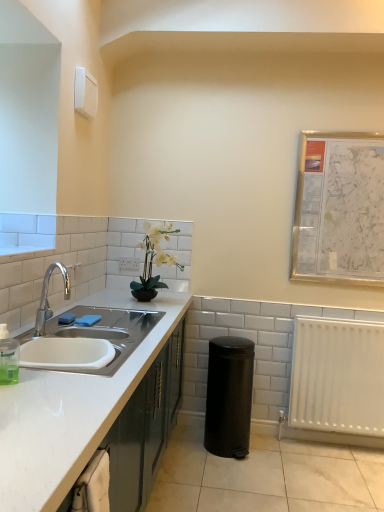
The width and height of the screenshot is (384, 512). I want to click on free point above silver metallic map at upper right (from a real-world perspective), so click(356, 129).